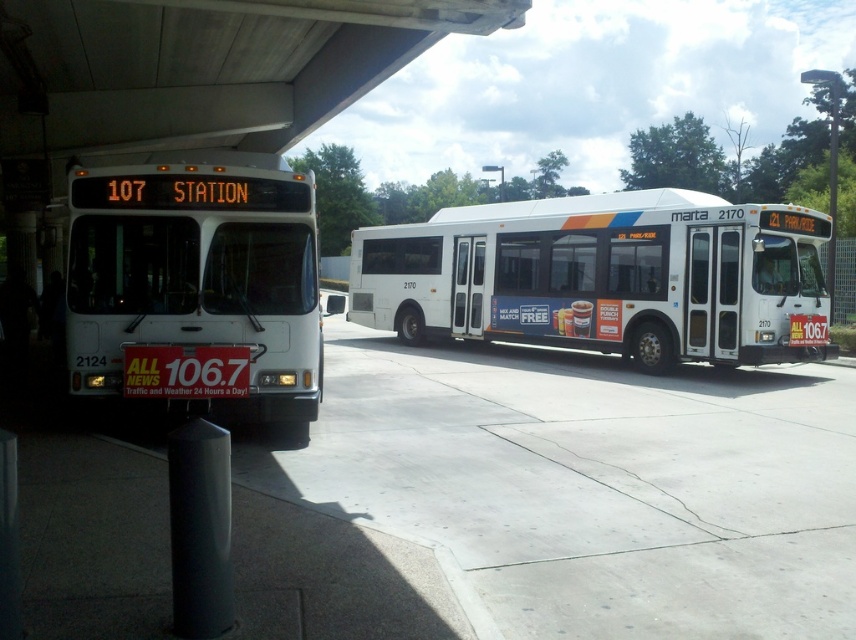
You are a bus driver who needs to park your new bus that is 12 feet tall. You see the white matte bus at center and the white matte bus at left. Which parking spot between them can accommodate your new bus based on their heights?

The white matte bus at center is taller than the white matte bus at left. Since your new bus is 12 feet tall, you should choose the parking spot next to the white matte bus at left, as it is shorter and likely has enough vertical clearance.

You are a delivery person needing to move a 10 meter long cargo container between the white matte bus at center and the white matte bus at left. Can you fit the cargo container between them without touching either bus?

The distance between the white matte bus at center and the white matte bus at left is 9.14 meters. Since the cargo container is 10 meters long, it cannot fit between them without touching either bus.

You are a passenger standing at the bus stop and want to board the white matte bus at center. Which direction should you walk from the white matte bus at left to reach it?

You should walk to the right from the white matte bus at left to reach the white matte bus at center since the white matte bus at center is positioned to the right of the white matte bus at left.